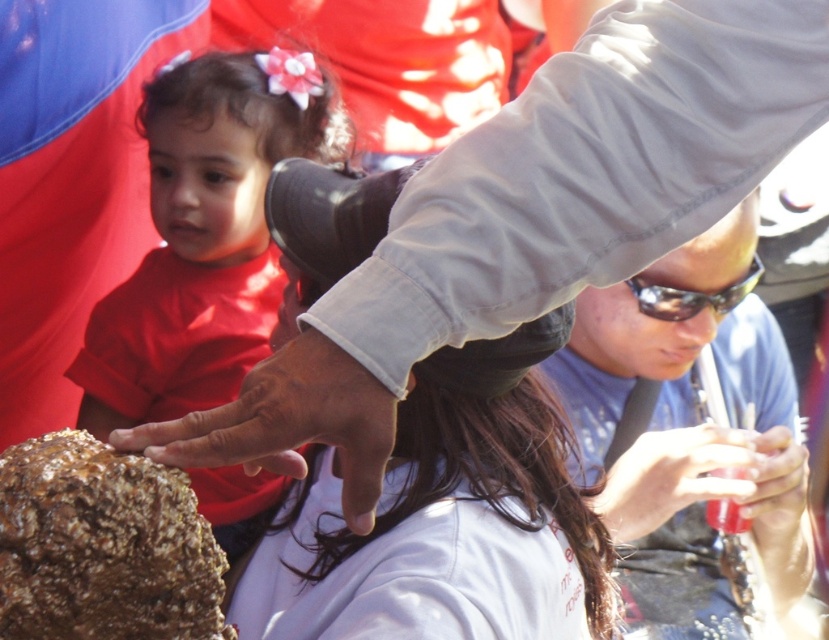
You are a photographer trying to capture a photo of the brown rough rock at center without any obstructions. The matte red shirt at left is in the way. Can you move to the right side to get an unobstructed view?

The matte red shirt at left is much taller than the brown rough rock at center, so moving to the right side might not help because the taller object could still block the view. You might need to adjust your angle or move further back to see over the matte red shirt at left.

You are a photographer trying to capture the brown rough rock at center and the translucent plastic cup at lower right in a single frame. Based on their positions, which object should you adjust your camera angle to focus on first to ensure both are in the frame?

The brown rough rock at center is to the left of the translucent plastic cup at lower right, so you should focus on the brown rough rock at center first to ensure both are included in the frame.

You are standing at the point labeled point [75,525] and want to see what is behind you. Is the point labeled point [648,433] behind you or in front of you?

The point labeled point [648,433] is behind you because the point labeled point [75,525] is in front of it.